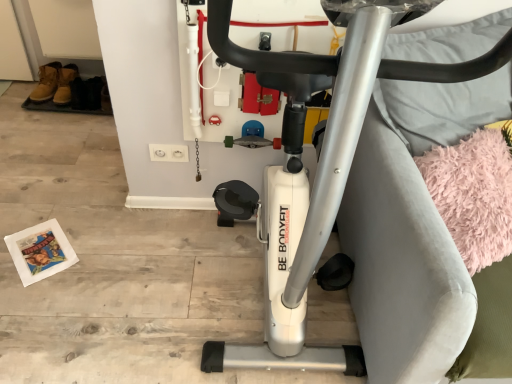
Question: From the image's perspective, does silver metallic stationary bicycle at center appear higher than pink fluffy yoga mat at right?

Choices:
 (A) yes
 (B) no

Answer: (A)

Question: Is silver metallic stationary bicycle at center located outside pink fluffy yoga mat at right?

Choices:
 (A) no
 (B) yes

Answer: (B)

Question: From a real-world perspective, is silver metallic stationary bicycle at center positioned under pink fluffy yoga mat at right based on gravity?

Choices:
 (A) yes
 (B) no

Answer: (B)

Question: Is silver metallic stationary bicycle at center next to pink fluffy yoga mat at right and touching it?

Choices:
 (A) yes
 (B) no

Answer: (B)

Question: Can you confirm if silver metallic stationary bicycle at center is positioned to the right of pink fluffy yoga mat at right?

Choices:
 (A) no
 (B) yes

Answer: (A)

Question: Can you confirm if silver metallic stationary bicycle at center is shorter than pink fluffy yoga mat at right?

Choices:
 (A) yes
 (B) no

Answer: (B)

Question: Can you confirm if pink fluffy yoga mat at right is bigger than silver metallic stationary bicycle at center?

Choices:
 (A) no
 (B) yes

Answer: (A)

Question: Is pink fluffy yoga mat at right far away from silver metallic stationary bicycle at center?

Choices:
 (A) yes
 (B) no

Answer: (B)

Question: Is pink fluffy yoga mat at right wider than silver metallic stationary bicycle at center?

Choices:
 (A) yes
 (B) no

Answer: (B)

Question: Is pink fluffy yoga mat at right in front of silver metallic stationary bicycle at center?

Choices:
 (A) yes
 (B) no

Answer: (B)

Question: From a real-world perspective, is pink fluffy yoga mat at right physically above silver metallic stationary bicycle at center?

Choices:
 (A) no
 (B) yes

Answer: (A)

Question: Can you see pink fluffy yoga mat at right touching silver metallic stationary bicycle at center?

Choices:
 (A) no
 (B) yes

Answer: (A)

Question: Is point (423, 167) positioned closer to the camera than point (354, 71)?

Choices:
 (A) farther
 (B) closer

Answer: (A)